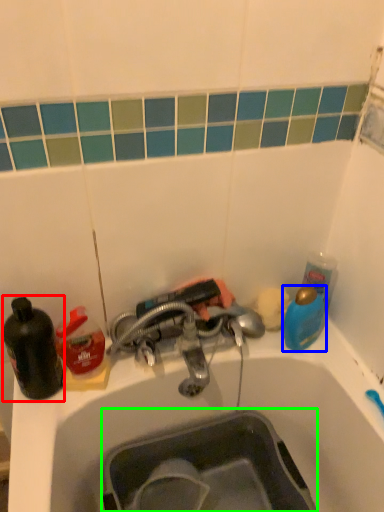
Question: Based on their relative distances, which object is nearer to bottle (highlighted by a red box)? Choose from teal (highlighted by a blue box) and sink (highlighted by a green box).

Choices:
 (A) teal
 (B) sink

Answer: (B)